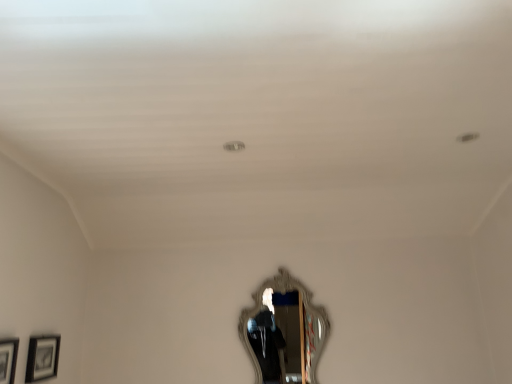
Question: Considering the positions of point (56, 342) and point (1, 362), is point (56, 342) closer or farther from the camera than point (1, 362)?

Choices:
 (A) farther
 (B) closer

Answer: (A)

Question: Looking at the image, does matte black picture frame at lower left, the 1th picture frame from the back, seem bigger or smaller compared to matte black picture frame at lower left, which is the 2th picture frame in back-to-front order?

Choices:
 (A) small
 (B) big

Answer: (A)

Question: Considering the real-world distances, which object is farthest from the silver ornate mirror at center?

Choices:
 (A) matte black picture frame at lower left, the first picture frame from the front
 (B) matte black picture frame at lower left, marked as the second picture frame in a front-to-back arrangement

Answer: (A)

Question: Based on their relative distances, which object is nearer to the matte black picture frame at lower left, marked as the second picture frame in a front-to-back arrangement?

Choices:
 (A) matte black picture frame at lower left, which is the 2th picture frame in back-to-front order
 (B) silver ornate mirror at center

Answer: (A)